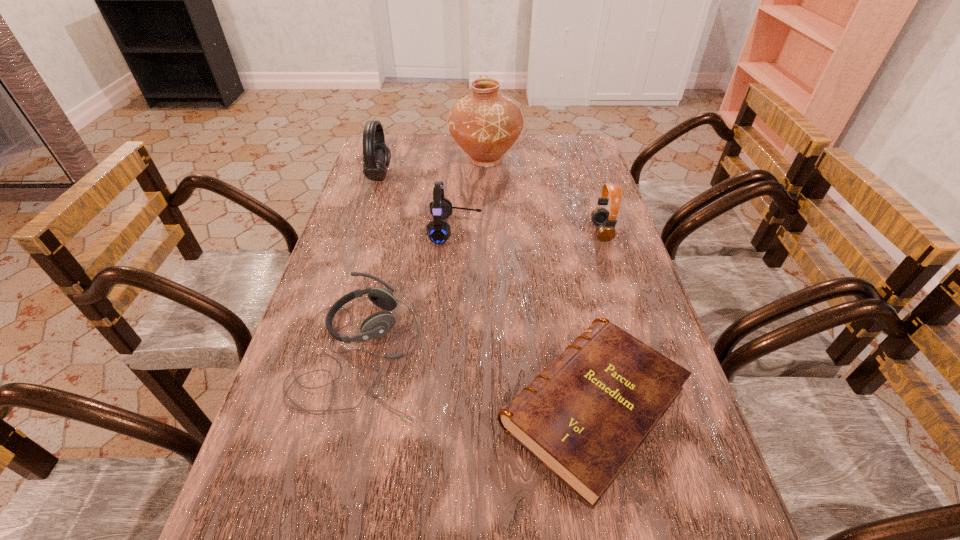
I want to click on free spot at the left edge of the desktop, so (398, 167).

In the image, there is a desktop. Identify the location of vacant space at the right edge. (628, 463).

Image resolution: width=960 pixels, height=540 pixels. What are the coordinates of `free space at the far left corner of the desktop` in the screenshot? It's located at (414, 148).

In the image, there is a desktop. Identify the location of vacant space at the far right corner. The width and height of the screenshot is (960, 540). (553, 138).

Find the location of a particular element. The height and width of the screenshot is (540, 960). free space between the rightmost headset and the tallest headset is located at coordinates (491, 203).

Where is `vacant space in between the rightmost headset and the shortest headset`? Image resolution: width=960 pixels, height=540 pixels. vacant space in between the rightmost headset and the shortest headset is located at coordinates (481, 292).

Find the location of a particular element. This screenshot has width=960, height=540. empty space between the shortest object and the tallest headset is located at coordinates (486, 291).

Where is `vacant region between the tallest object and the rightmost headset`? vacant region between the tallest object and the rightmost headset is located at coordinates (543, 195).

At what (x,y) coordinates should I click in order to perform the action: click on vacant space that's between the second tallest object and the nearest headset. Please return your answer as a coordinate pair (x, y). Image resolution: width=960 pixels, height=540 pixels. Looking at the image, I should click on (370, 263).

This screenshot has height=540, width=960. I want to click on vacant space that is in between the tallest headset and the rightmost headset, so click(491, 203).